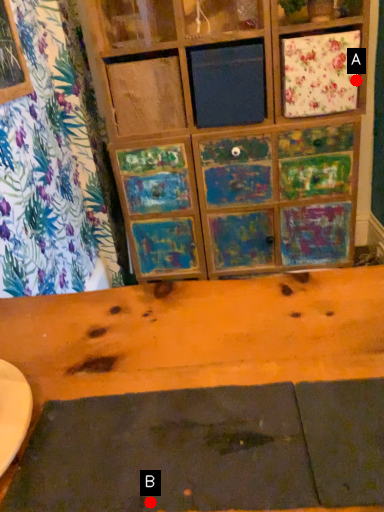
Question: Two points are circled on the image, labeled by A and B beside each circle. Which of the following is the farthest from the observer?

Choices:
 (A) A is further
 (B) B is further

Answer: (A)